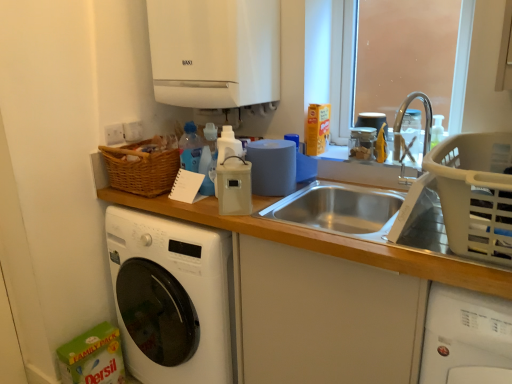
Question: Visually, is white glossy boiler at upper center, which ranks as the 2th appliance in bottom-to-top order, positioned to the left or to the right of white plastic washing machine at lower right, the 2th washing machine viewed from the left?

Choices:
 (A) left
 (B) right

Answer: (A)

Question: From a real-world perspective, is white glossy boiler at upper center, which ranks as the 2th appliance in bottom-to-top order, physically located above or below white plastic washing machine at lower right, the 2th washing machine viewed from the left?

Choices:
 (A) below
 (B) above

Answer: (B)

Question: Considering the real-world distances, which object is farthest from the beige plastic container at center, the 1th appliance ordered from the bottom?

Choices:
 (A) translucent plastic window screen at upper right
 (B) white glossy washing machine at lower left, the second washing machine viewed from the right
 (C) white glossy boiler at upper center, which ranks as the 2th appliance in bottom-to-top order
 (D) gray plastic basket at right
 (E) white plastic washing machine at lower right, the 2th washing machine viewed from the left

Answer: (A)

Question: Which object is positioned farthest from the gray plastic basket at right?

Choices:
 (A) white glossy washing machine at lower left, the 1th washing machine from the left
 (B) white glossy boiler at upper center, which ranks as the 2th appliance in bottom-to-top order
 (C) translucent plastic window screen at upper right
 (D) beige plastic container at center, which is counted as the first appliance, starting from the front
 (E) white plastic washing machine at lower right, the 2th washing machine viewed from the left

Answer: (C)